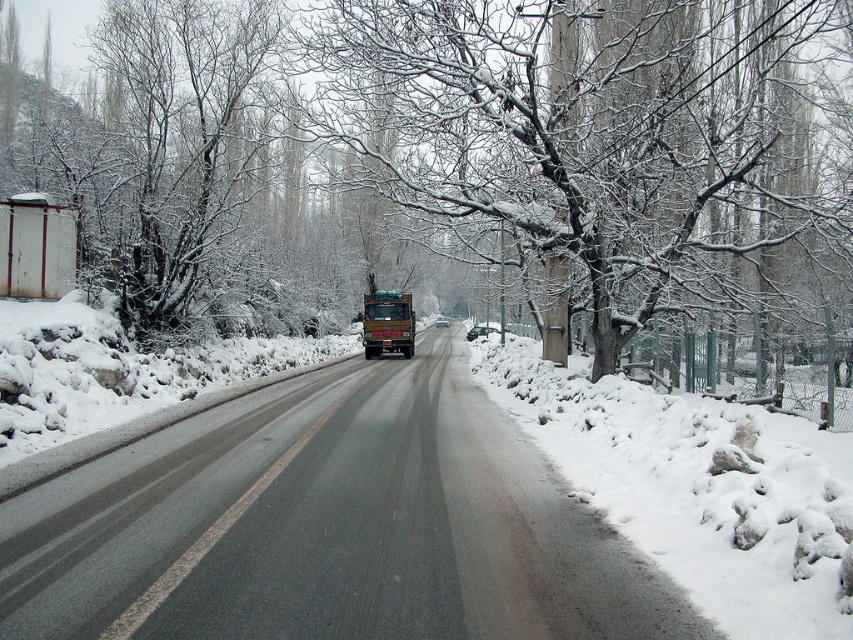
You are driving a car that is 4 meters long and want to pass the metallic truck at center on this two lane road. Can you safely pass the truck without crossing the double yellow line?

The distance between your car and the metallic truck at center is 4.57 meters. Since your car is 4 meters long, you can safely pass the truck without crossing the double yellow line as the available space is sufficient.

You are driving a car and see two trucks ahead on the snowy road. The metallic truck at center and the matte brown truck at center. Which truck is closer to you?

The metallic truck at center is closer because it is in front of the matte brown truck at center.